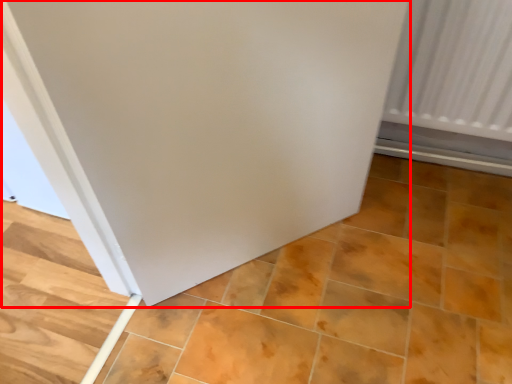
Question: Observing the image, what is the correct spatial positioning of door (annotated by the red box) in reference to ceramic tile?

Choices:
 (A) right
 (B) left

Answer: (B)